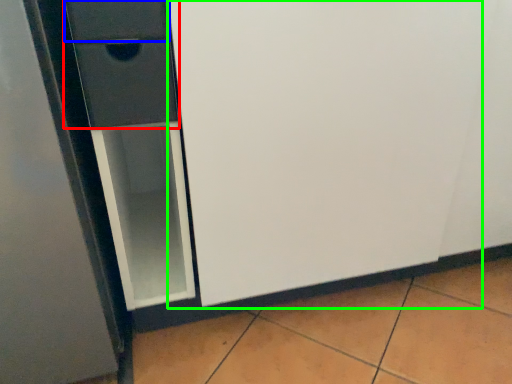
Question: Which is farther away from drawer (highlighted by a red box)? drawer (highlighted by a blue box) or screen door (highlighted by a green box)?

Choices:
 (A) drawer
 (B) screen door

Answer: (B)